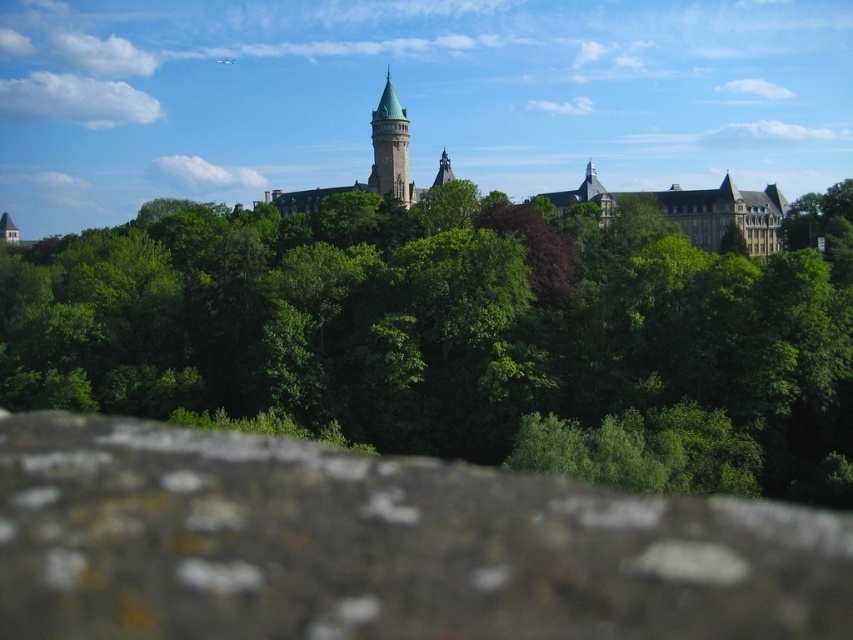
Can you confirm if brown rough stone at lower center is positioned below green stone castle at center?

Indeed, brown rough stone at lower center is positioned under green stone castle at center.

Which is behind, point (483, 589) or point (769, 250)?

The point (769, 250) is behind.

You are a GUI agent. You are given a task and a screenshot of the screen. Output one action in this format:
    pyautogui.click(x=<x>, y=<y>)
    Task: Click on the brown rough stone at lower center
    
    Given the screenshot: What is the action you would take?
    pyautogui.click(x=380, y=545)

Between point (514, 257) and point (3, 548), which one is positioned in front?

Point (3, 548) is more forward.

Can you confirm if green leafy tree at center is shorter than brown rough stone at lower center?

Incorrect, green leafy tree at center's height does not fall short of brown rough stone at lower center's.

Which is behind, point (679, 403) or point (44, 500)?

Positioned behind is point (679, 403).

This screenshot has height=640, width=853. Find the location of `green leafy tree at center`. green leafy tree at center is located at coordinates (442, 330).

You are a GUI agent. You are given a task and a screenshot of the screen. Output one action in this format:
    pyautogui.click(x=<x>, y=<y>)
    Task: Click on the green stone castle at center
    The height and width of the screenshot is (640, 853).
    Given the screenshot: What is the action you would take?
    pyautogui.click(x=695, y=211)

Is point (675, 184) closer to camera compared to point (374, 168)?

No, (675, 184) is behind (374, 168).

Is point (773, 224) positioned behind point (390, 120)?

Yes, point (773, 224) is behind point (390, 120).

Find the location of a particular element. The image size is (853, 640). green stone castle at center is located at coordinates (695, 211).